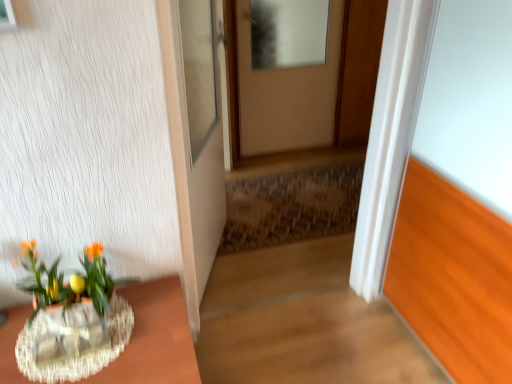
You are a GUI agent. You are given a task and a screenshot of the screen. Output one action in this format:
    pyautogui.click(x=<x>, y=<y>)
    Task: Click on the vacant region to the right of clear glass vase at lower left
    The image size is (512, 384).
    Given the screenshot: What is the action you would take?
    pyautogui.click(x=113, y=350)